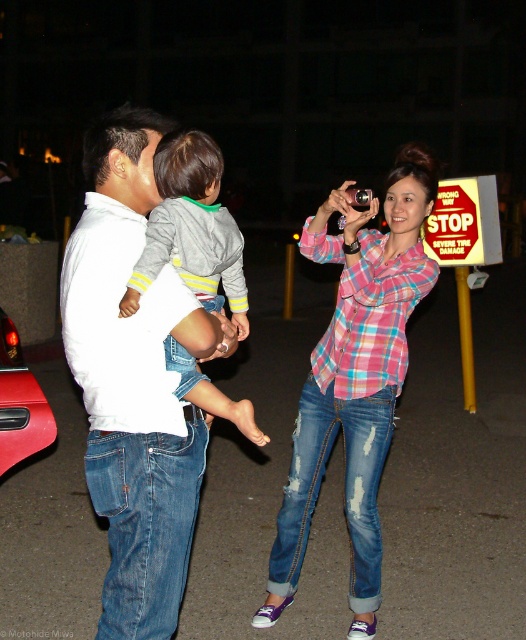
Does pink plaid shirt at center have a greater height compared to shiny red car at lower left?

Indeed, pink plaid shirt at center has a greater height compared to shiny red car at lower left.

Does point (352, 595) come farther from viewer compared to point (17, 403)?

No.

Image resolution: width=526 pixels, height=640 pixels. Identify the location of pink plaid shirt at center. (356, 378).

Who is more distant from viewer, (100, 192) or (2, 428)?

The point (2, 428) is more distant.

Who is more forward, (229, 337) or (25, 432)?

Point (229, 337) is more forward.

Where is `white cotton shirt at center`? The height and width of the screenshot is (640, 526). white cotton shirt at center is located at coordinates (135, 381).

Who is positioned more to the right, gray fleece sweater at center or shiny red car at lower left?

Positioned to the right is gray fleece sweater at center.

Is gray fleece sweater at center thinner than shiny red car at lower left?

Yes, gray fleece sweater at center is thinner than shiny red car at lower left.

Who is more distant from viewer, (209,289) or (13,380)?

The point (13,380) is behind.

Find the location of a particular element. This screenshot has width=526, height=640. gray fleece sweater at center is located at coordinates (191, 228).